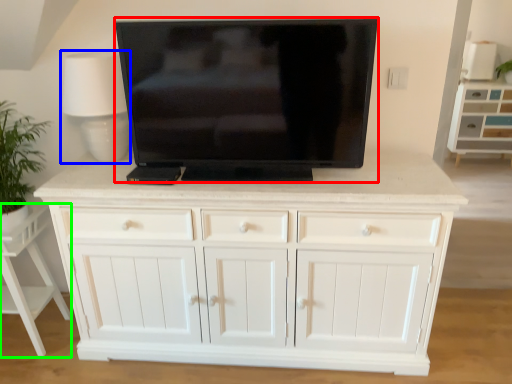
Question: Considering the real-world distances, which object is closest to television (highlighted by a red box)? table lamp (highlighted by a blue box) or vanity (highlighted by a green box).

Choices:
 (A) table lamp
 (B) vanity

Answer: (A)